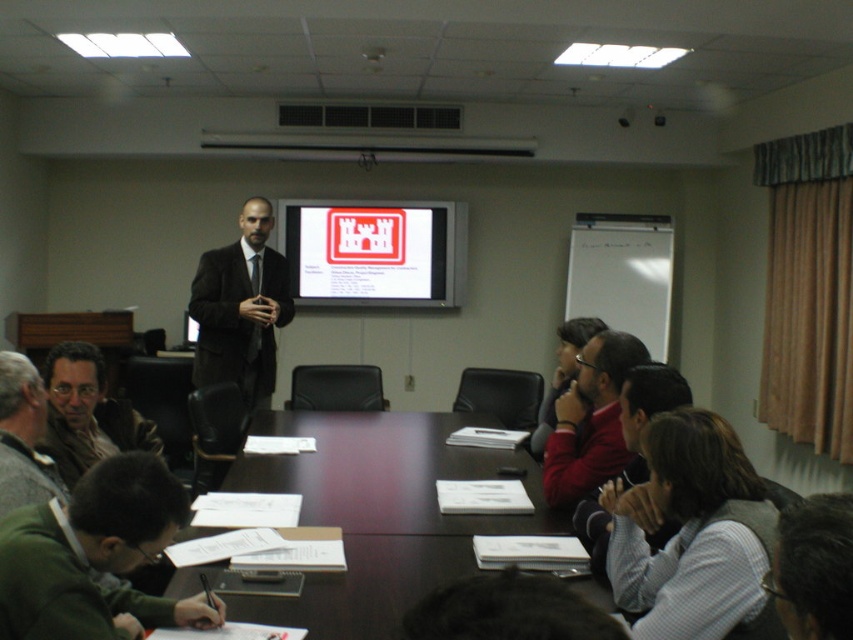
You are standing in the conference room and need to locate the dark wood table at center. According to the coordinates provided, where would you find it?

The dark wood table at center is located at the coordinates point (376, 515).

You are an office assistant who needs to deliver a document to the person wearing the red sweater at center and the gray wool sweater at lower left. You are currently standing at the entrance of the conference room. Which person should you approach first if you want to reach the one closer to the entrance?

The gray wool sweater at lower left is closer to the entrance than the red sweater at center, so you should approach the gray wool sweater at lower left first.

You are a presenter standing at the front of the room. You need to pick up a document from the dark wood table at center and hand it to the person in the black matte suit at center. Can you reach the document without moving from your current position?

The dark wood table at center is 1.03 meters away from the black matte suit at center. Since you are standing at the front of the room, the distance between you and the table is not specified, so it is unclear if you can reach the document without moving.